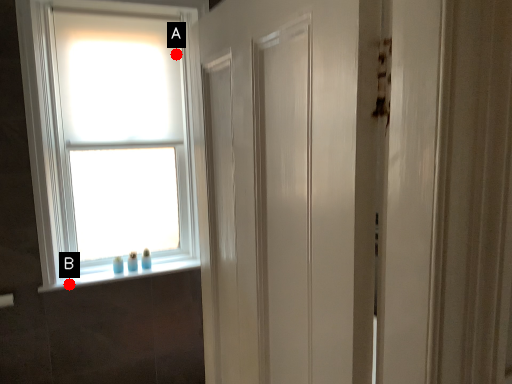
Question: Two points are circled on the image, labeled by A and B beside each circle. Which point is closer to the camera?

Choices:
 (A) A is closer
 (B) B is closer

Answer: (B)